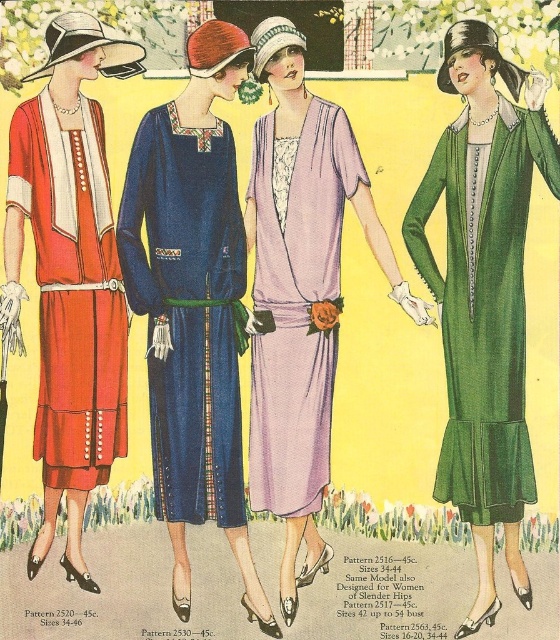
Question: Which of the following is the closest to the observer?

Choices:
 (A) shiny green coat at right
 (B) matte orange dress at left

Answer: (B)

Question: Which object is farther from the camera taking this photo?

Choices:
 (A) lavender silk dress at center
 (B) matte orange dress at left
 (C) lavender satin dress at center
 (D) velvet blue dress at center

Answer: (C)

Question: Among these objects, which one is nearest to the camera?

Choices:
 (A) shiny green coat at right
 (B) velvet blue dress at center

Answer: (B)

Question: Is the position of shiny green coat at right more distant than that of lavender silk dress at center?

Choices:
 (A) no
 (B) yes

Answer: (B)

Question: Is the position of matte orange dress at left more distant than that of lavender silk dress at center?

Choices:
 (A) yes
 (B) no

Answer: (A)

Question: In this image, where is lavender silk dress at center located relative to lavender satin dress at center?

Choices:
 (A) right
 (B) left

Answer: (A)